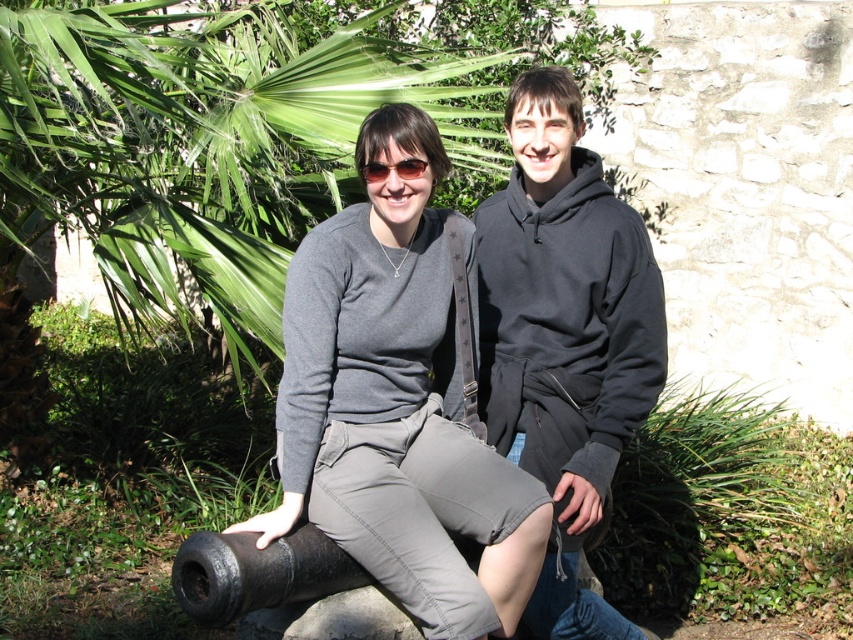
You are trying to identify clothing items in the scene. Which clothing item is located to the left of the other between the matte gray pants at center and the matte gray sweatshirt at center?

The matte gray sweatshirt at center is to the left of the matte gray pants at center because the matte gray pants at center is positioned on the right side of matte gray sweatshirt at center.

You are a tour guide leading a group and want to ensure everyone can see both the green leafy palm tree at upper left and the black matte cannon at lower left. Given that the group is standing 10 feet away from the cannon, will they be able to see both objects clearly?

The distance between the green leafy palm tree at upper left and the black matte cannon at lower left is 7.02 feet. Since the group is standing 10 feet away from the cannon, they are within a reasonable viewing distance to see both objects clearly.

Looking at this image, based on the scene description, if you were standing where the two people are, which object would be closer to your left side, the matte gray pants at center or the black fleece sweatshirt at center?

The matte gray pants at center are to the left of the black fleece sweatshirt at center, so the matte gray pants at center would be closer to your left side.